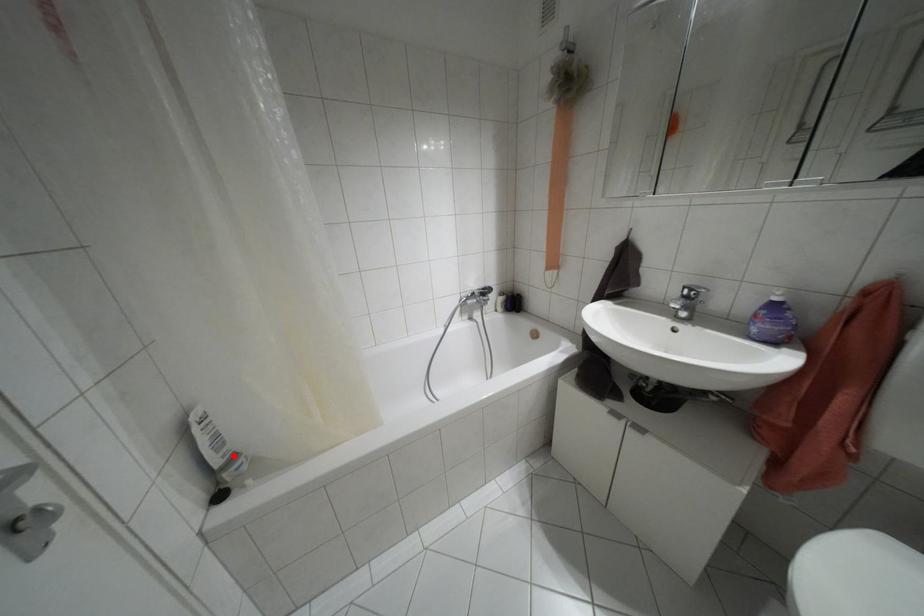
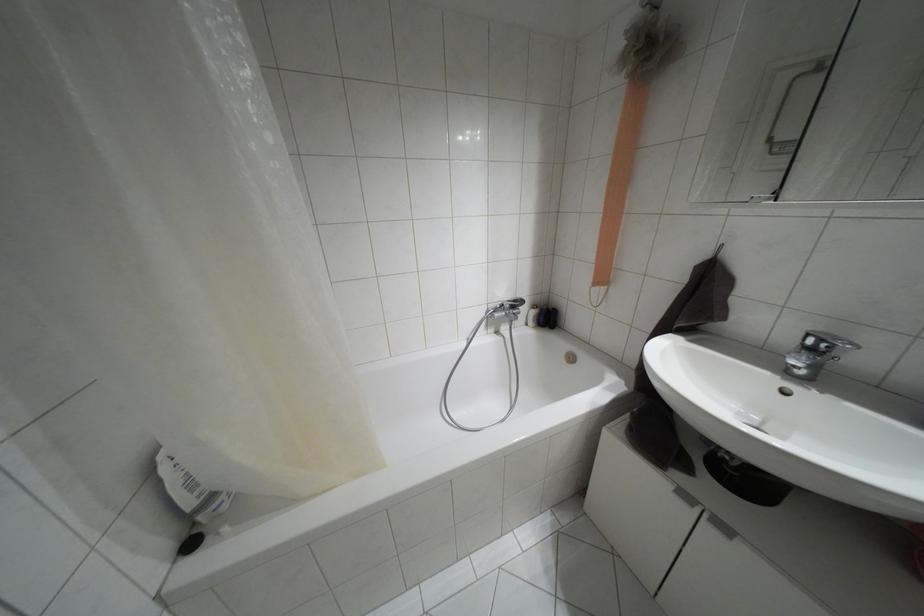
Locate, in the second image, the point that corresponds to the highlighted location in the first image.

(212, 496)